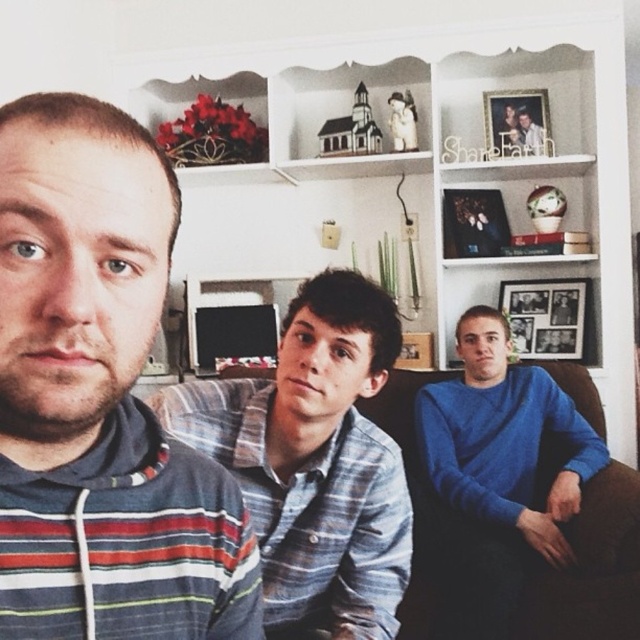
Question: Does brown leather couch at right appear on the left side of blue striped shirt at center?

Choices:
 (A) no
 (B) yes

Answer: (B)

Question: Which point appears farthest from the camera in this image?

Choices:
 (A) (230, 388)
 (B) (515, 298)
 (C) (44, 513)
 (D) (516, 113)

Answer: (B)

Question: In this image, where is wooden photo frame at upper right located relative to blue striped shirt at center?

Choices:
 (A) below
 (B) above

Answer: (B)

Question: Which point is closer to the camera?

Choices:
 (A) (13, 310)
 (B) (508, 140)
 (C) (520, 128)

Answer: (A)

Question: Which object is closer to the camera taking this photo?

Choices:
 (A) wooden photo frame at upper right
 (B) blue striped shirt at center
 (C) striped hoodie at left
 (D) wooden photo frame at center

Answer: (C)

Question: Can you confirm if striped hoodie at left is bigger than blue striped shirt at center?

Choices:
 (A) no
 (B) yes

Answer: (B)